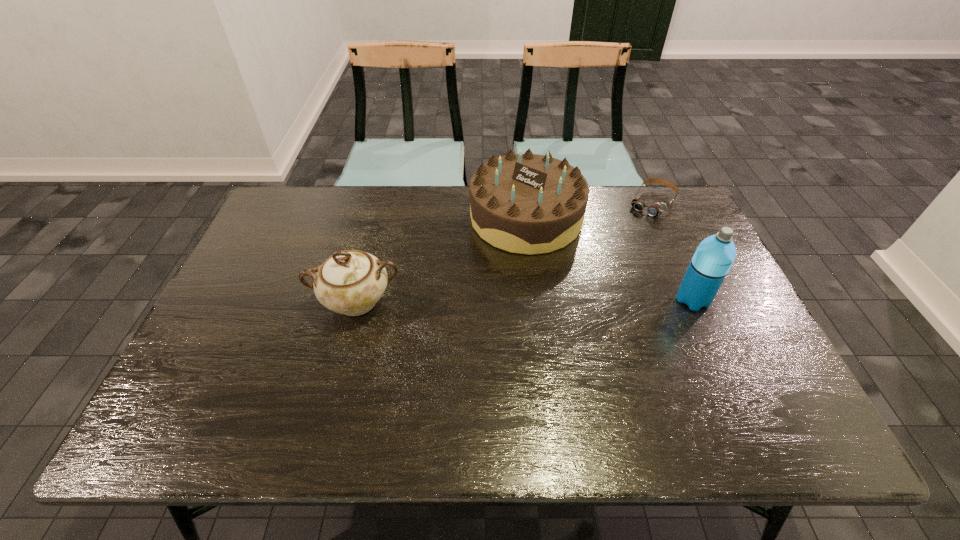
What are the coordinates of `free space between the birthday cake and the shortest object` in the screenshot? It's located at (588, 210).

Find the location of a particular element. The height and width of the screenshot is (540, 960). vacant area that lies between the chinaware and the third object from right to left is located at coordinates (442, 260).

Identify which object is located as the third nearest to the third object from right to left. Please provide its 2D coordinates. Your answer should be formatted as a tuple, i.e. [(x, y)], where the tuple contains the x and y coordinates of a point satisfying the conditions above.

[(711, 262)]

Image resolution: width=960 pixels, height=540 pixels. Identify the location of the closest object to the birthday cake. point(656,209).

This screenshot has width=960, height=540. What are the coordinates of `free spot that satisfies the following two spatial constraints: 1. on the back side of the goggles; 2. on the left side of the tallest object` in the screenshot? It's located at (649, 203).

This screenshot has height=540, width=960. Identify the location of vacant point that satisfies the following two spatial constraints: 1. on the back side of the chinaware; 2. on the left side of the shortest object. (382, 203).

The width and height of the screenshot is (960, 540). What are the coordinates of `free location that satisfies the following two spatial constraints: 1. on the back side of the shortest object; 2. on the right side of the leftmost object` in the screenshot? It's located at click(382, 203).

I want to click on free space that satisfies the following two spatial constraints: 1. on the back side of the shortest object; 2. on the right side of the leftmost object, so click(382, 203).